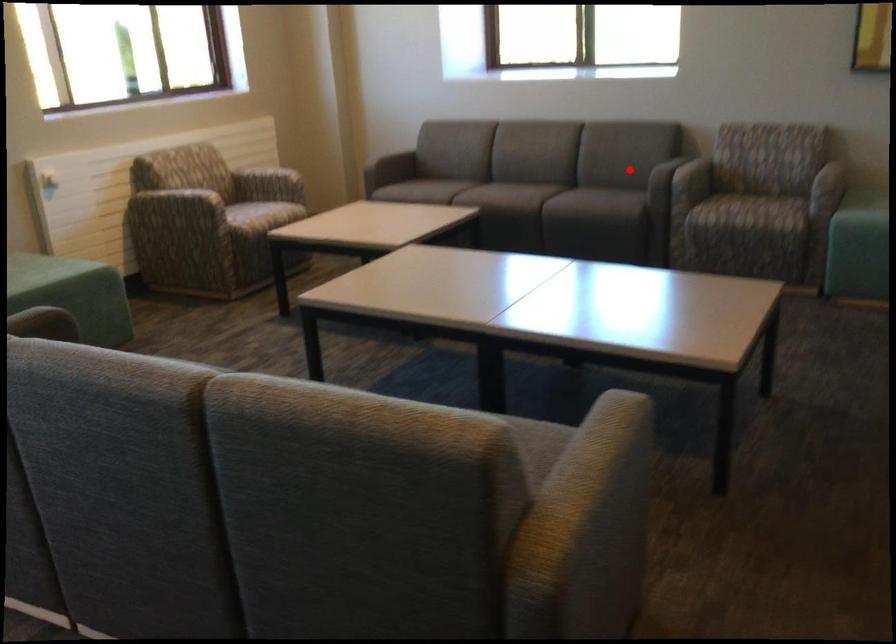
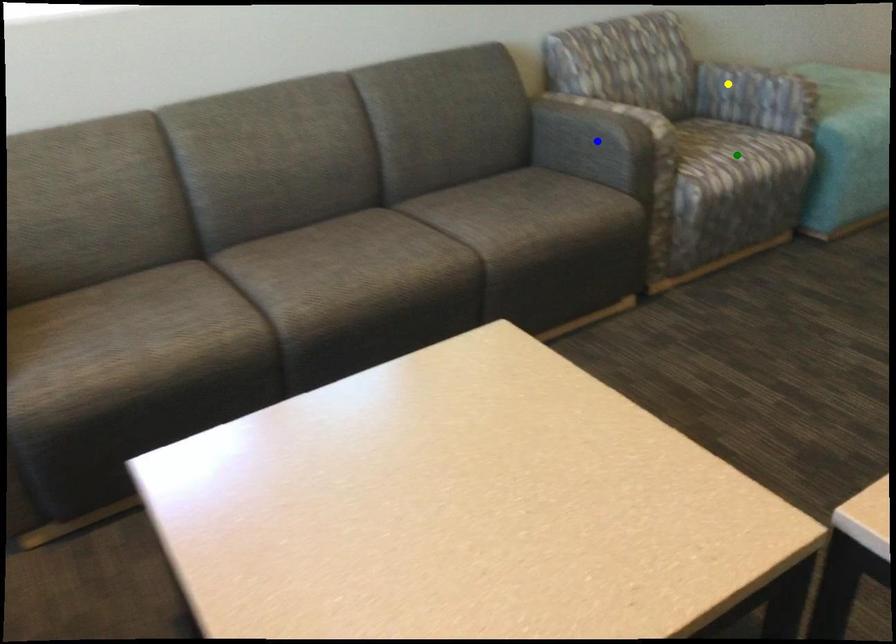
Question: I am providing you with two images of the same scene from different viewpoints. A red point is marked on the first image. You are given multiple points on the second image. Can you choose the point in image 2 that corresponds to the point in image 1?

Choices:
 (A) blue point
 (B) yellow point
 (C) green point

Answer: (A)